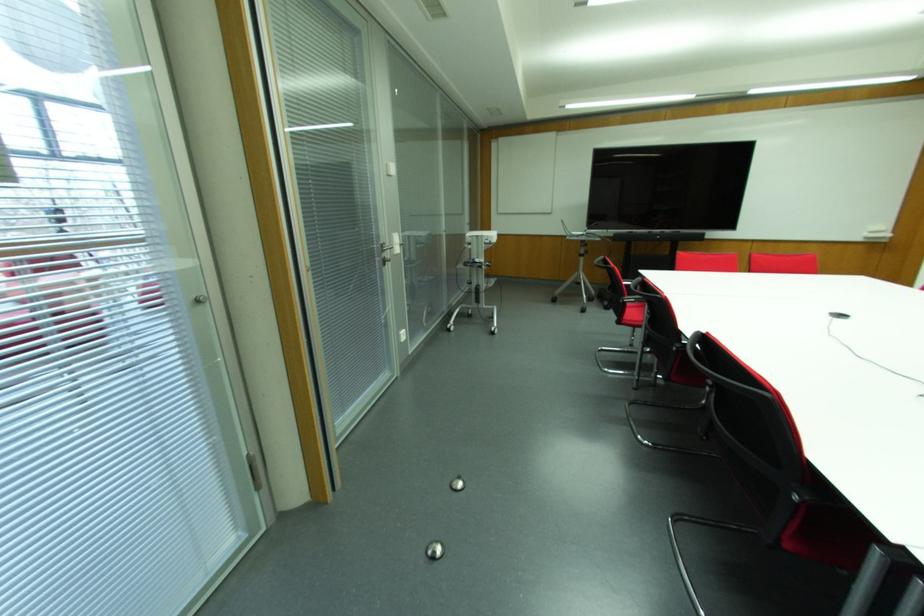
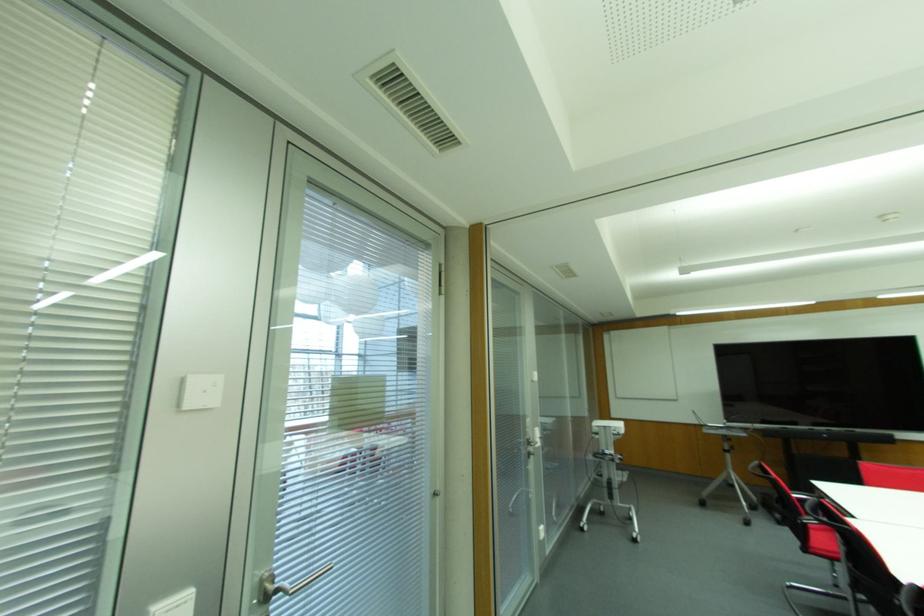
The point at [566,238] is marked in the first image. Where is the corresponding point in the second image?

(704, 430)